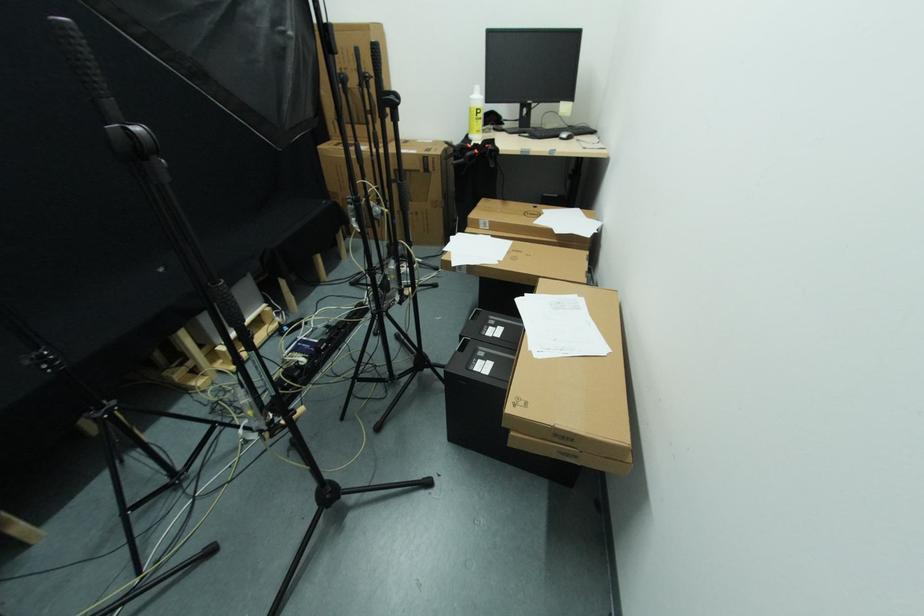
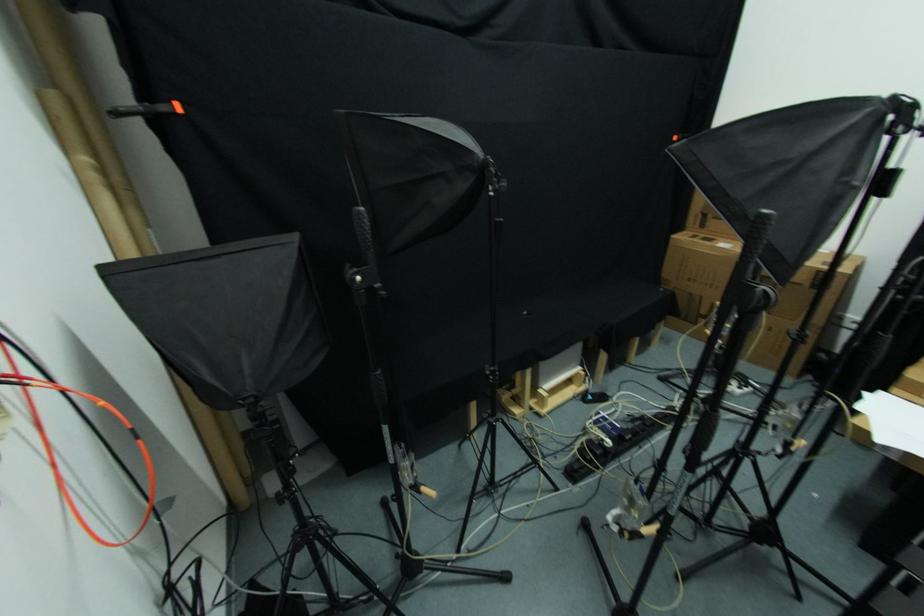
Question: The camera is either moving clockwise (left) or counter-clockwise (right) around the object. The first image is from the beginning of the video and the second image is from the end. Is the camera moving left or right when shooting the video?

Choices:
 (A) Left
 (B) Right

Answer: (B)